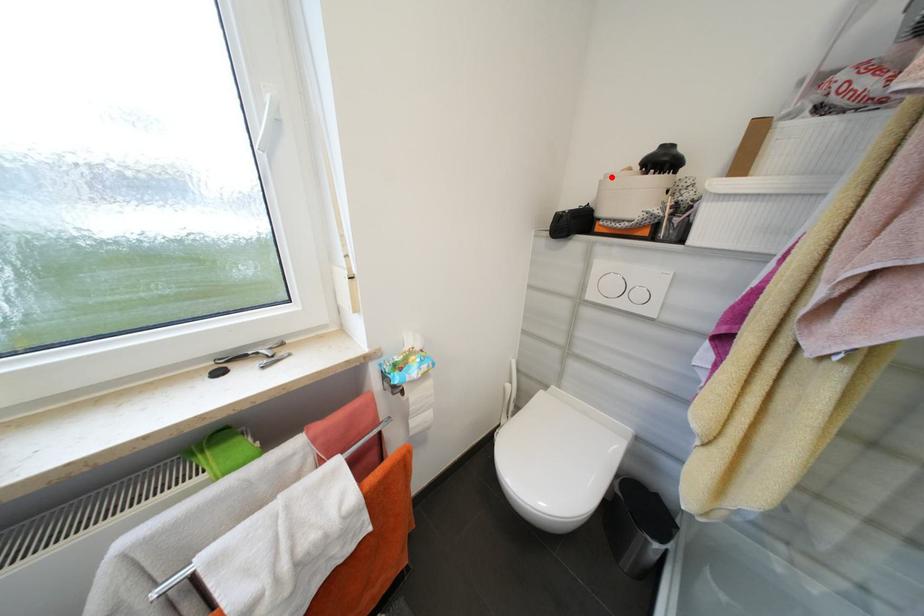
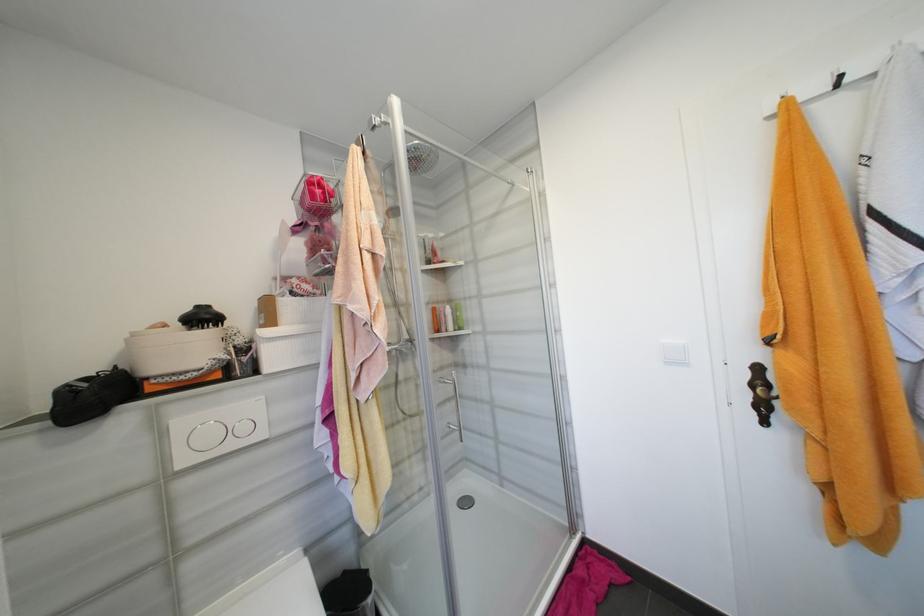
Question: I am providing you with two images of the same scene from different viewpoints. A red point is marked on the first image. At the location where the point appears in image 1, is it still visible in image 2?

Choices:
 (A) Yes
 (B) No

Answer: (A)